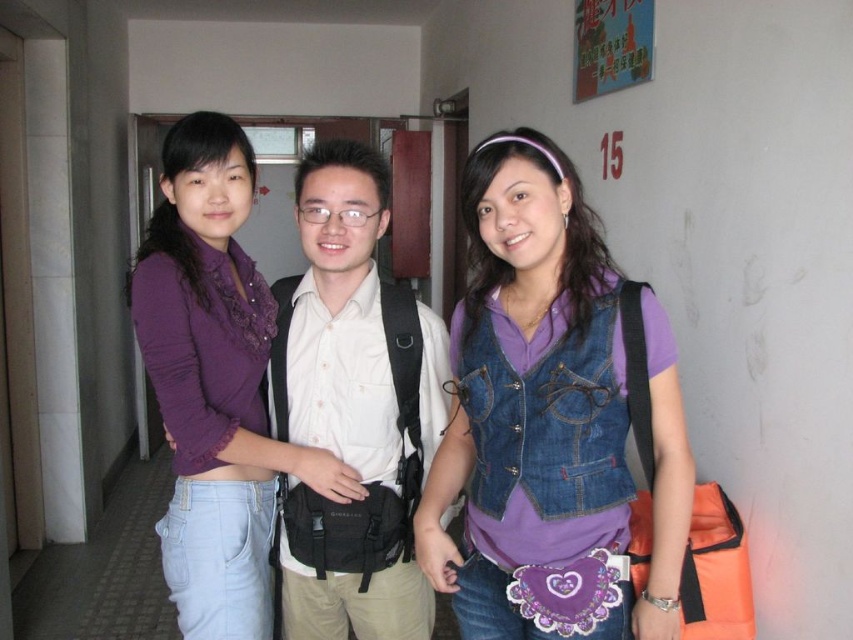
Question: Can you confirm if denim vest at center is wider than white matte shirt at center?

Choices:
 (A) no
 (B) yes

Answer: (B)

Question: Estimate the real-world distances between objects in this image. Which object is closer to the purple lace shirt at center?

Choices:
 (A) white matte shirt at center
 (B) denim vest at center

Answer: (A)

Question: Which point is closer to the camera taking this photo?

Choices:
 (A) (419, 392)
 (B) (258, 417)

Answer: (A)

Question: Which object is closer to the camera taking this photo?

Choices:
 (A) purple lace shirt at center
 (B) denim vest at center
 (C) white matte shirt at center

Answer: (B)

Question: Does white matte shirt at center appear under purple lace shirt at center?

Choices:
 (A) yes
 (B) no

Answer: (A)

Question: Does denim vest at center have a smaller size compared to purple lace shirt at center?

Choices:
 (A) yes
 (B) no

Answer: (A)